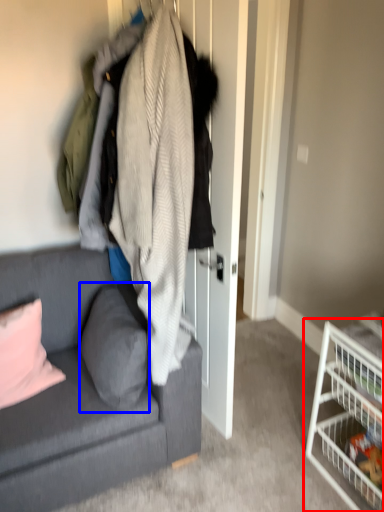
Question: Which of the following is the closest to the observer, shelf (highlighted by a red box) or pillow (highlighted by a blue box)?

Choices:
 (A) shelf
 (B) pillow

Answer: (A)